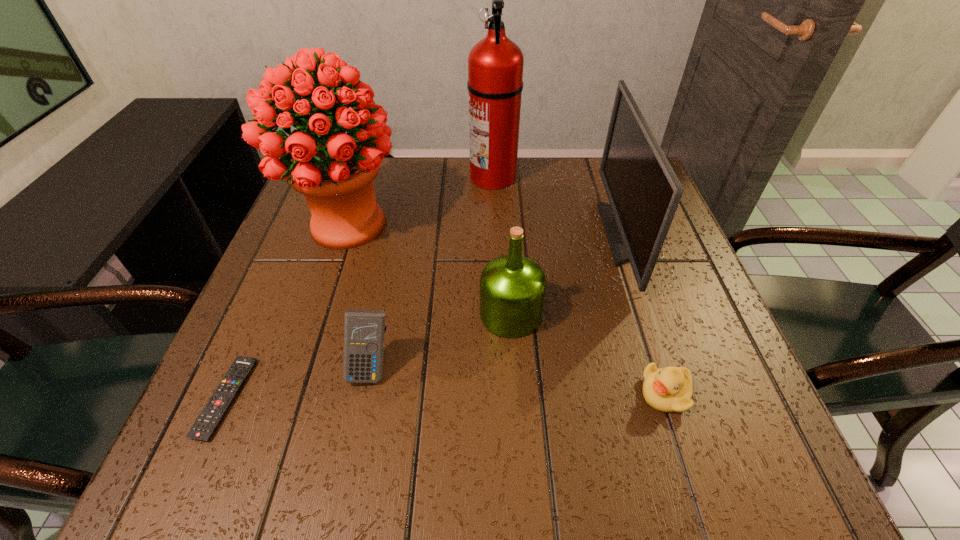
Where is `fire extinguisher that is at the far edge`? fire extinguisher that is at the far edge is located at coordinates (495, 64).

This screenshot has width=960, height=540. Identify the location of bouquet that is at the far edge. (334, 171).

The width and height of the screenshot is (960, 540). In order to click on monitor that is at the far edge in this screenshot , I will do `click(644, 192)`.

Where is `object positioned at the near edge`? The height and width of the screenshot is (540, 960). object positioned at the near edge is located at coordinates (209, 419).

You are a GUI agent. You are given a task and a screenshot of the screen. Output one action in this format:
    pyautogui.click(x=<x>, y=<y>)
    Task: Click on the bouquet that is at the left edge
    The width and height of the screenshot is (960, 540).
    Given the screenshot: What is the action you would take?
    pyautogui.click(x=334, y=171)

This screenshot has width=960, height=540. In order to click on remote control that is at the left edge in this screenshot , I will do `click(209, 419)`.

Where is `monitor located at the right edge`? The width and height of the screenshot is (960, 540). monitor located at the right edge is located at coordinates (644, 192).

This screenshot has width=960, height=540. I want to click on duckling present at the right edge, so click(x=669, y=389).

Locate an element on the screen. The height and width of the screenshot is (540, 960). object positioned at the far left corner is located at coordinates (334, 171).

Where is `object that is at the near left corner`? object that is at the near left corner is located at coordinates click(209, 419).